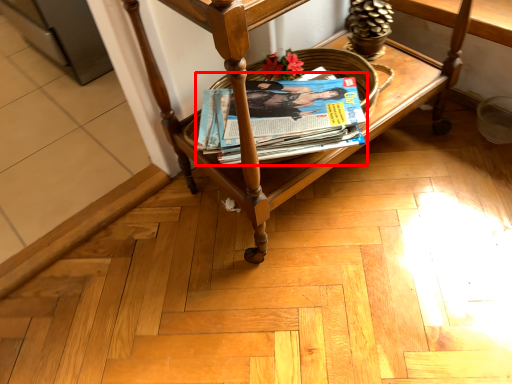
Question: Considering the relative positions of magazine (annotated by the red box) and furniture in the image provided, where is magazine (annotated by the red box) located with respect to the staircase?

Choices:
 (A) left
 (B) right

Answer: (A)